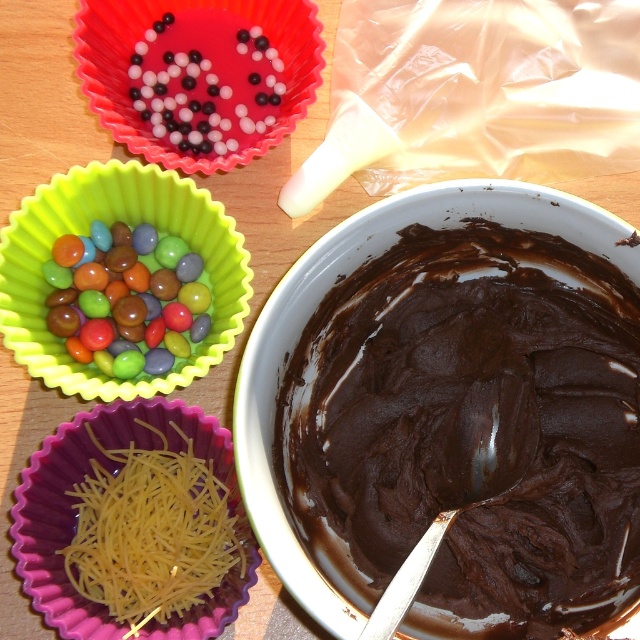
Question: Which object appears closest to the camera in this image?

Choices:
 (A) yellow string cheese at lower left
 (B) black glossy beads at upper center

Answer: (A)

Question: Estimate the real-world distances between objects in this image. Which object is farther from the shiny plastic cupcake liner at upper left?

Choices:
 (A) dark chocolate paste at center
 (B) yellow string cheese at lower left

Answer: (A)

Question: Can you confirm if dark chocolate paste at center is positioned to the left of yellow string cheese at lower left?

Choices:
 (A) yes
 (B) no

Answer: (B)

Question: Which point is farther to the camera?

Choices:
 (A) (477, 472)
 (B) (116, 470)
 (C) (198, 337)

Answer: (C)

Question: Considering the relative positions of shiny plastic cupcake liner at upper left and shiny silver spoon at center in the image provided, where is shiny plastic cupcake liner at upper left located with respect to shiny silver spoon at center?

Choices:
 (A) below
 (B) above

Answer: (B)

Question: Is dark chocolate paste at center thinner than black glossy beads at upper center?

Choices:
 (A) no
 (B) yes

Answer: (A)